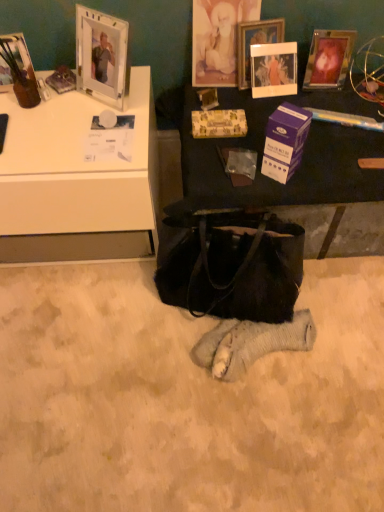
Locate an element on the screen. vacant space that is to the left of black leather handbag at center is located at coordinates (120, 323).